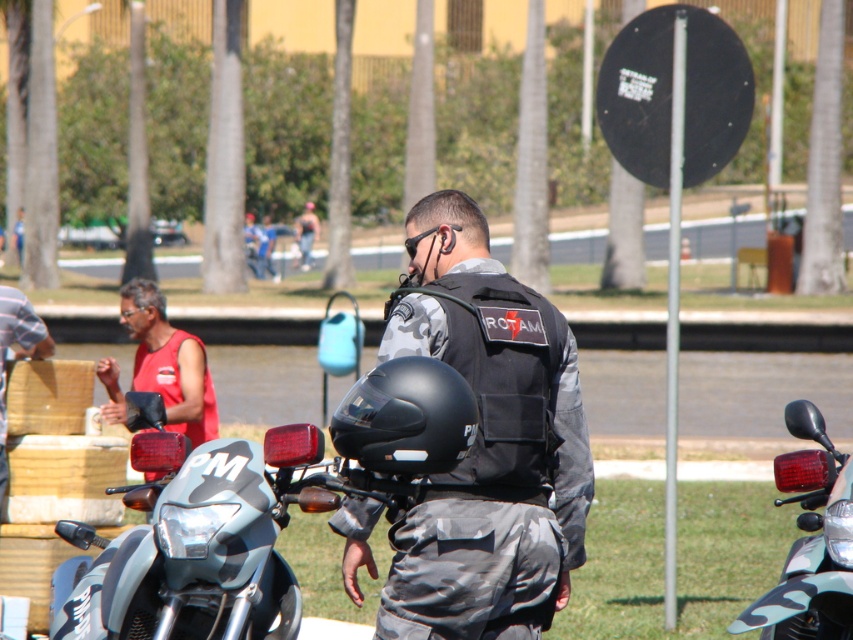
You are a delivery drone operator. Your drone needs to fly between the camouflage uniform at center and the matte black helmet at center to deliver a package. What is the minimum vertical clearance required for the drone to pass safely between them?

The distance between the camouflage uniform at center and the matte black helmet at center is 20.96 inches. To ensure safe passage, the drone should maintain a vertical clearance of at least 20.96 inches between them.

You are a photographer trying to capture a clear shot of the camouflage uniform at center without the matte black helmet at center blocking it. Based on their positions, where should you adjust your camera to focus?

The matte black helmet at center is behind the camouflage uniform at center, so you should focus your camera on the camouflage uniform at center to ensure the helmet does not block the view.